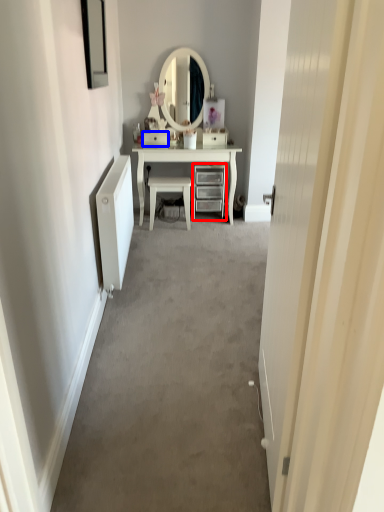
Question: Which point is further to the camera, chest of drawers (highlighted by a red box) or drawer (highlighted by a blue box)?

Choices:
 (A) chest of drawers
 (B) drawer

Answer: (B)